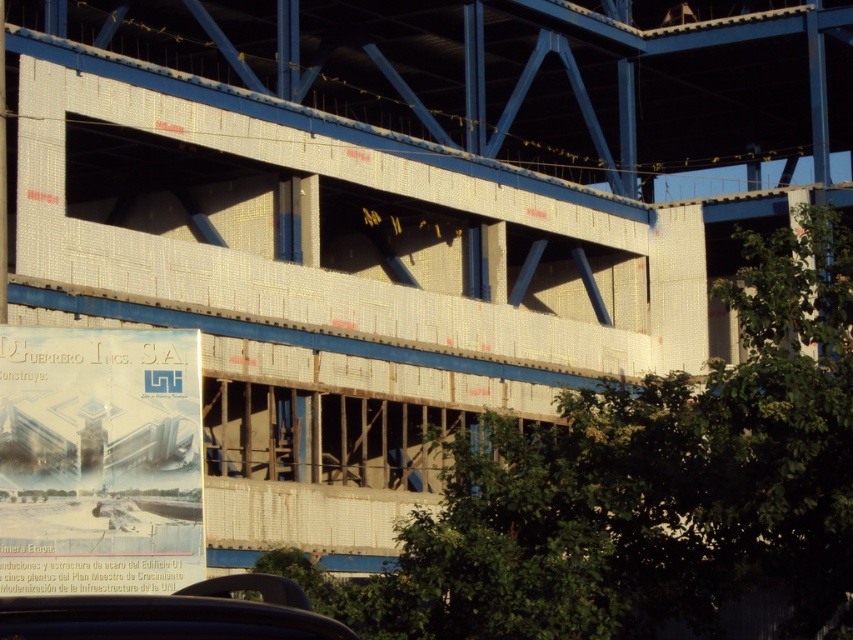
Question: Which point is closer to the camera taking this photo?

Choices:
 (A) (105, 449)
 (B) (323, 627)

Answer: (B)

Question: Is white paper poster at center further to the viewer compared to black matte car at lower center?

Choices:
 (A) yes
 (B) no

Answer: (A)

Question: Can you confirm if white paper poster at center is thinner than black matte car at lower center?

Choices:
 (A) no
 (B) yes

Answer: (B)

Question: Can you confirm if white paper poster at center is positioned below black matte car at lower center?

Choices:
 (A) no
 (B) yes

Answer: (A)

Question: Which point is farther from the camera taking this photo?

Choices:
 (A) (47, 612)
 (B) (128, 560)

Answer: (B)